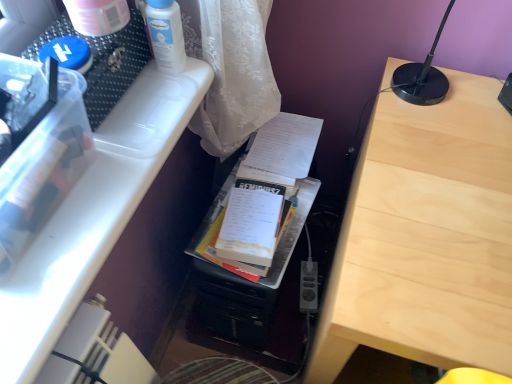
Image resolution: width=512 pixels, height=384 pixels. I want to click on free space in front of white glossy lotion at upper center, so click(x=150, y=116).